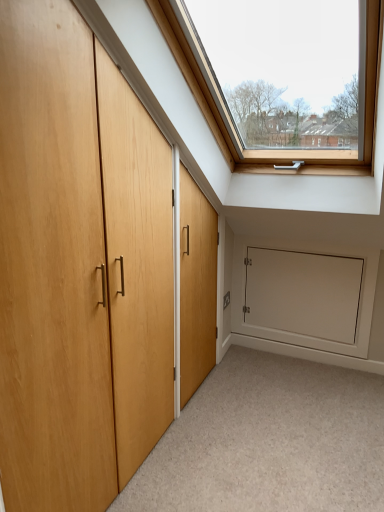
Question: From their relative heights in the image, would you say light wood door at left is taller or shorter than carpeted floor at lower center?

Choices:
 (A) tall
 (B) short

Answer: (A)

Question: In the image, is light wood door at left positioned in front of or behind carpeted floor at lower center?

Choices:
 (A) front
 (B) behind

Answer: (A)

Question: Considering the real-world distances, which object is closest to the light wood door at left?

Choices:
 (A) white matte door at lower right
 (B) carpeted floor at lower center

Answer: (B)

Question: Considering the real-world distances, which object is closest to the white matte door at lower right?

Choices:
 (A) light wood door at left
 (B) carpeted floor at lower center

Answer: (B)